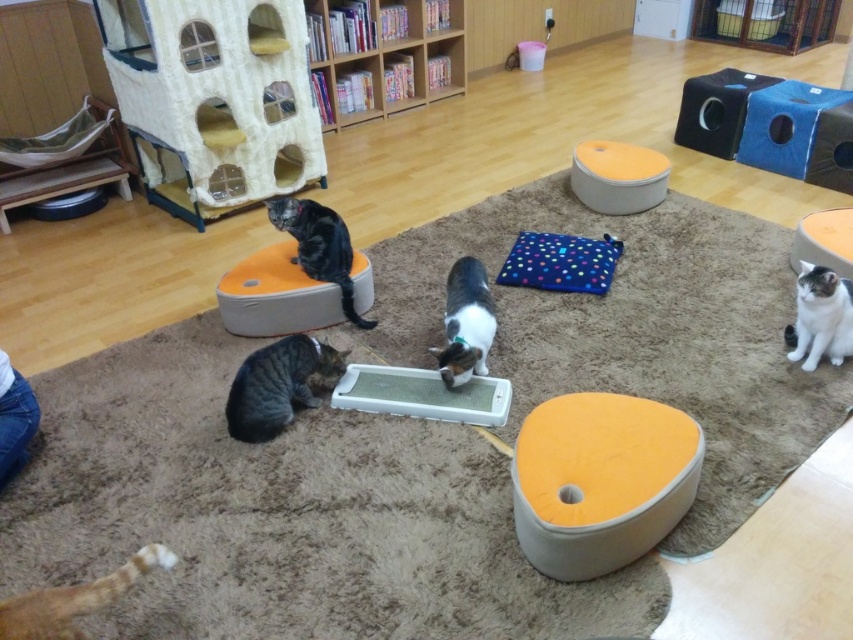
You are a cat owner visiting the cat cafe and want to choose a seat between the tabby fur cat at lower left and the white and gray fur cat at lower right. Which cat has a wider body so you can sit farther away from it to avoid disturbance?

The tabby fur cat at lower left has a wider body than the white and gray fur cat at lower right, so you should sit farther away from the tabby fur cat at lower left to avoid disturbing it.